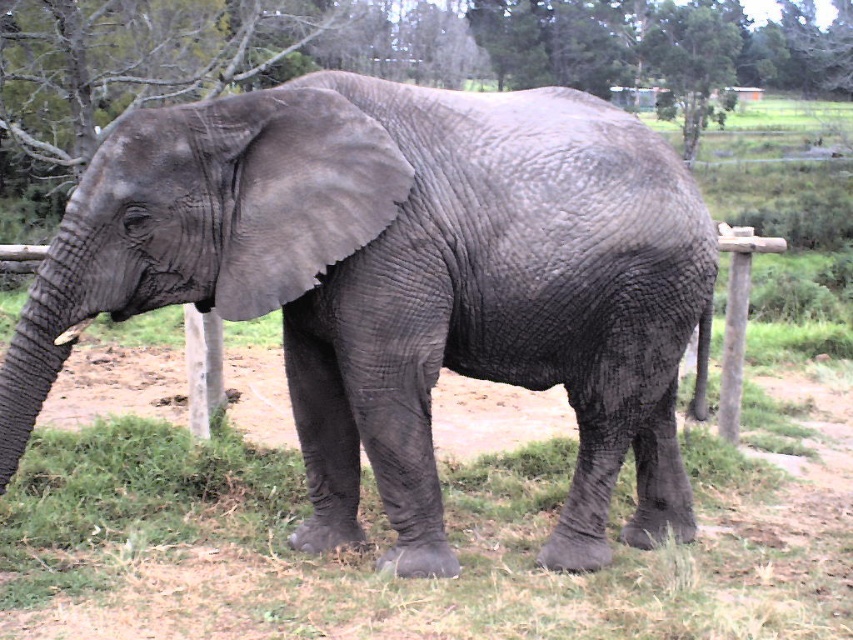
You are a visitor at the zoo and want to take a photo of the gray rough elephant at center and the green leafy tree at upper center. Which object is positioned higher in the image?

The green leafy tree at upper center is positioned higher in the image than the gray rough elephant at center.

You are standing at the point with coordinates point (695, 136) and want to move towards the elephant. Is the point point (149, 212) between you and the elephant?

Yes, the point (149, 212) is between you and the elephant because it is in front of point (695, 136) where you are standing.

You are a visitor at the zoo and want to take a photo of the gray rough elephant at center and the green leafy tree at upper center. Which one should you focus on first to ensure both are in clear view?

You should focus on the gray rough elephant at center first because it is closer to the viewer than the green leafy tree at upper center, so adjusting focus from the elephant to the tree will help keep both in clear view.